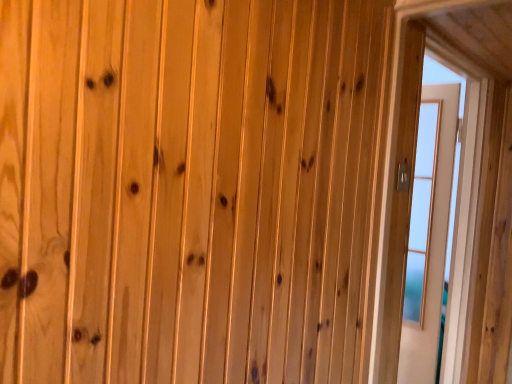
Question: Is transparent glass door at right bigger or smaller than light brown wood door at right?

Choices:
 (A) small
 (B) big

Answer: (B)

Question: Is transparent glass door at right inside or outside of light brown wood door at right?

Choices:
 (A) outside
 (B) inside

Answer: (A)

Question: Based on their positions, is transparent glass door at right located to the left or right of light brown wood door at right?

Choices:
 (A) left
 (B) right

Answer: (A)

Question: Considering the positions of light brown wood door at right and transparent glass door at right in the image, is light brown wood door at right bigger or smaller than transparent glass door at right?

Choices:
 (A) small
 (B) big

Answer: (A)

Question: Is point (450, 144) closer or farther from the camera than point (397, 302)?

Choices:
 (A) closer
 (B) farther

Answer: (B)

Question: Is light brown wood door at right wider or thinner than transparent glass door at right?

Choices:
 (A) thin
 (B) wide

Answer: (A)

Question: Do you think light brown wood door at right is within transparent glass door at right, or outside of it?

Choices:
 (A) inside
 (B) outside

Answer: (B)